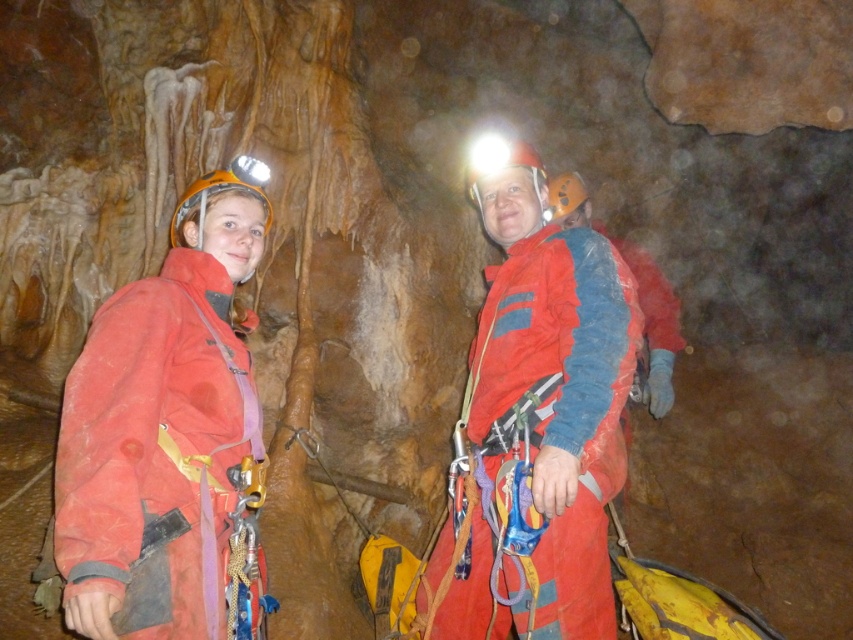
Question: Where is matte orange helmet at left located in relation to matte red jacket at center in the image?

Choices:
 (A) below
 (B) above

Answer: (A)

Question: Is matte orange helmet at left positioned behind matte red jacket at center?

Choices:
 (A) no
 (B) yes

Answer: (A)

Question: Among these points, which one is farthest from the camera?

Choices:
 (A) coord(552,531)
 (B) coord(146,474)

Answer: (A)

Question: Among these objects, which one is nearest to the camera?

Choices:
 (A) matte red jacket at center
 (B) matte orange helmet at left

Answer: (B)

Question: Which object is closer to the camera taking this photo?

Choices:
 (A) matte red jacket at center
 (B) matte orange helmet at left

Answer: (B)

Question: In this image, where is matte orange helmet at left located relative to matte red jacket at center?

Choices:
 (A) right
 (B) left

Answer: (B)